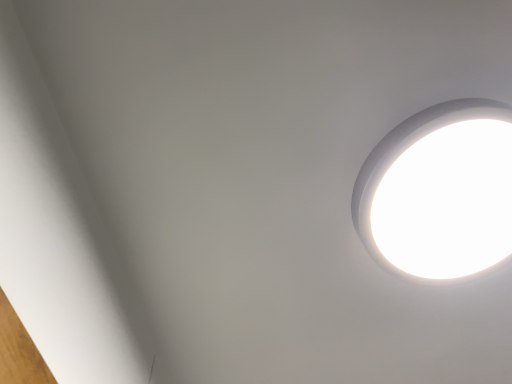
The width and height of the screenshot is (512, 384). What do you see at coordinates (406, 149) in the screenshot?
I see `white matte lamp at upper right` at bounding box center [406, 149].

Locate an element on the screen. The width and height of the screenshot is (512, 384). white matte lamp at upper right is located at coordinates (406, 149).

You are a GUI agent. You are given a task and a screenshot of the screen. Output one action in this format:
    pyautogui.click(x=<x>, y=<y>)
    Task: Click on the white matte lamp at upper right
    
    Given the screenshot: What is the action you would take?
    pyautogui.click(x=406, y=149)